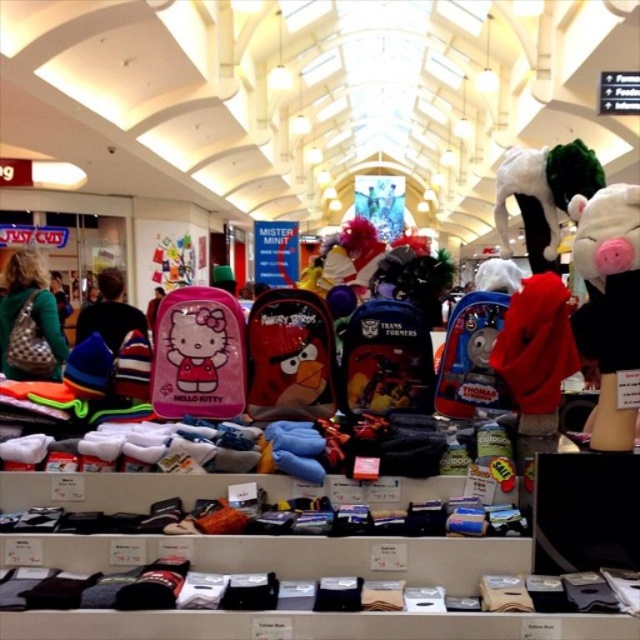
Question: Estimate the real-world distances between objects in this image. Which object is closer to the pink matte backpack at left?

Choices:
 (A) white plush pig at center
 (B) fluffy white plush toy at upper right
 (C) black matte hat at center
 (D) pink matte hello kitty backpack at center

Answer: (D)

Question: Which point is farther from the camera taking this photo?

Choices:
 (A) pyautogui.click(x=577, y=321)
 (B) pyautogui.click(x=604, y=340)
 (C) pyautogui.click(x=259, y=353)
 (D) pyautogui.click(x=122, y=333)

Answer: (D)

Question: Is pink matte hello kitty backpack at center bigger than angry bird backpack at center?

Choices:
 (A) yes
 (B) no

Answer: (A)

Question: Is angry bird backpack at center bigger than red fleece sweatshirt at center?

Choices:
 (A) no
 (B) yes

Answer: (A)

Question: Which point is closer to the camera taking this photo?

Choices:
 (A) (627, 310)
 (B) (8, 330)

Answer: (A)

Question: Does blue fabric thomas the tank engine backpack at center lie in front of pink matte backpack at left?

Choices:
 (A) no
 (B) yes

Answer: (B)